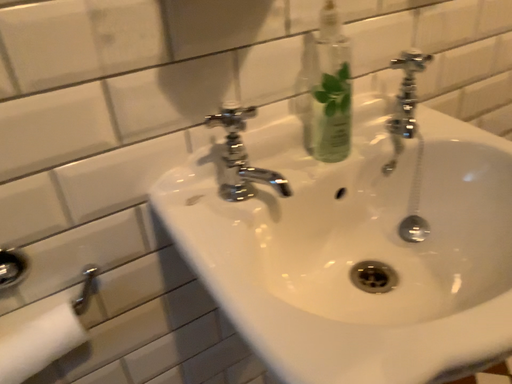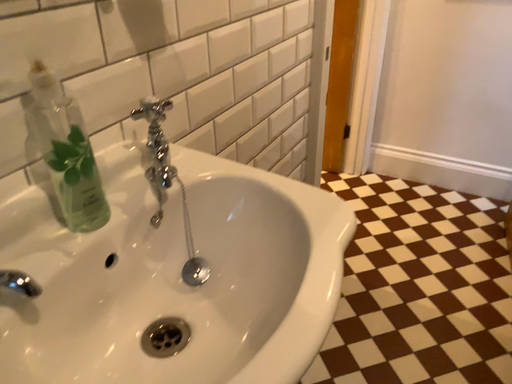
Question: Which way did the camera rotate in the video?

Choices:
 (A) rotated left
 (B) rotated right

Answer: (B)